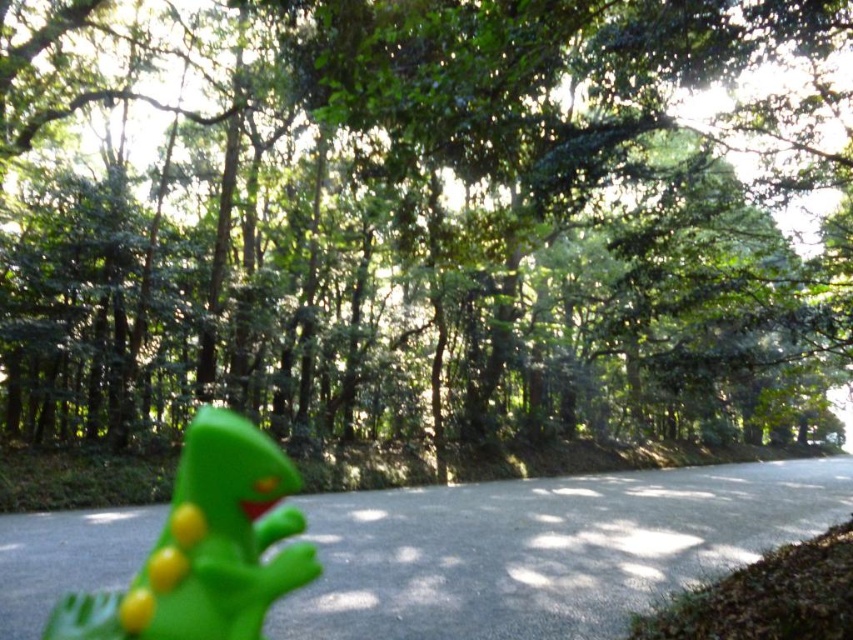
Question: Observing the image, what is the correct spatial positioning of green matte tree at center in reference to green rubber toy at lower left?

Choices:
 (A) left
 (B) right

Answer: (B)

Question: Which point is farther to the camera?

Choices:
 (A) (134, 211)
 (B) (196, 616)

Answer: (A)

Question: Can you confirm if green matte tree at center is wider than green rubber toy at lower left?

Choices:
 (A) yes
 (B) no

Answer: (A)

Question: Does green matte tree at center have a lesser width compared to green rubber toy at lower left?

Choices:
 (A) no
 (B) yes

Answer: (A)